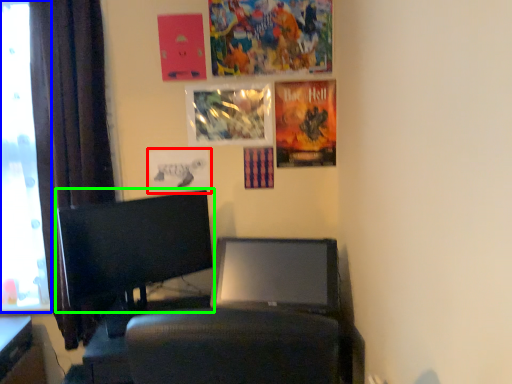
Question: Based on their relative distances, which object is farther from poster page (highlighted by a red box)? Choose from window screen (highlighted by a blue box) and computer monitor (highlighted by a green box).

Choices:
 (A) window screen
 (B) computer monitor

Answer: (A)